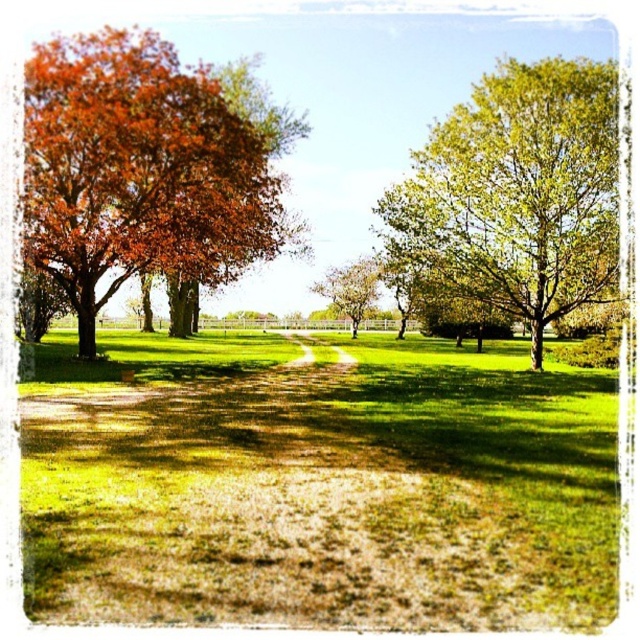
Is orange leafy tree at left behind green leafy tree at center?

No, orange leafy tree at left is closer to the viewer.

Can you confirm if orange leafy tree at left is positioned above green leafy tree at center?

Correct, orange leafy tree at left is located above green leafy tree at center.

Find the location of a particular element. Image resolution: width=640 pixels, height=640 pixels. orange leafy tree at left is located at coordinates (144, 170).

At what (x,y) coordinates should I click in order to perform the action: click on orange leafy tree at left. Please return your answer as a coordinate pair (x, y). Looking at the image, I should click on (144, 170).

Can you confirm if green grass at center is smaller than orange leafy tree at left?

Correct, green grass at center occupies less space than orange leafy tree at left.

Who is higher up, green grass at center or orange leafy tree at left?

orange leafy tree at left is above.

Identify the location of green grass at center. (330, 492).

I want to click on green grass at center, so click(330, 492).

Between point (337, 435) and point (372, 273), which one is positioned in front?

Point (337, 435) is more forward.

Between point (464, 371) and point (321, 291), which one is positioned behind?

The point (321, 291) is behind.

I want to click on green grass at center, so click(330, 492).

Identify the location of green grass at center. (330, 492).